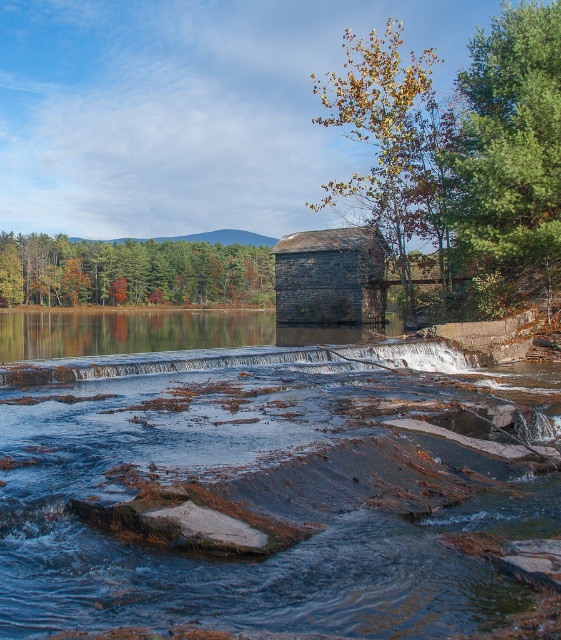
You are standing in the middle of the dam and see the green textured pine tree at upper right and the green matte tree at upper left. Which tree is located to the right of the other?

The green textured pine tree at upper right is positioned on the right side of green matte tree at upper left.

You are standing at the edge of the dam looking towards the waterfall. You notice two points marked on the rocks below. Which of the two points, point (387, 102) or point (280, 349), is closer to your current position?

Point (387, 102) is further to the camera than point (280, 349), so the closer point to your current position is point (280, 349).

You are standing at the base of the dam and looking up towards the trees. Which tree, the green textured pine tree at upper right or the green matte tree at upper left, is positioned higher in the scene?

The green textured pine tree at upper right is positioned higher in the scene than the green matte tree at upper left.